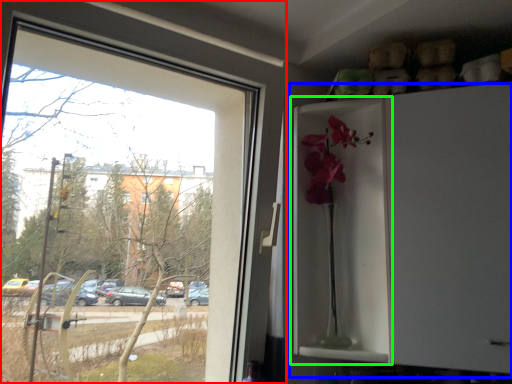
Question: Considering the real-world distances, which object is closest to window (highlighted by a red box)? fridge (highlighted by a blue box) or screen door (highlighted by a green box).

Choices:
 (A) fridge
 (B) screen door

Answer: (B)